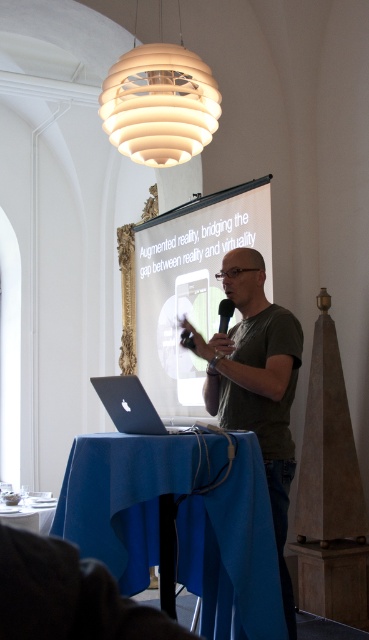
You are standing at point (135, 22) and want to walk to point (156, 323). Which direction should you move?

You should move backward because point (156, 323) is behind point (135, 22).

You are sitting in the audience and looking at the presenter. Which object is closer to your left side, the matte green shirt at center or the silver metallic laptop at lower left?

The silver metallic laptop at lower left is closer to your left side because it is positioned to the left of the matte green shirt at center.

Based on the photo, you are standing in the presentation venue and see the matte green shirt at center. Can you determine its exact location using coordinates?

The matte green shirt at center is located at coordinates point [256,385].